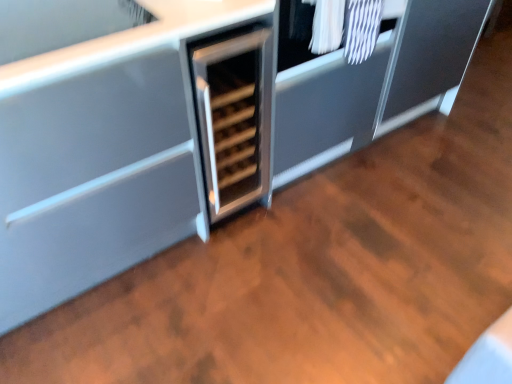
Question: Is satin silver wine cooler at center inside the boundaries of white textured laundry at upper right, or outside?

Choices:
 (A) inside
 (B) outside

Answer: (B)

Question: Is satin silver wine cooler at center in front of or behind white textured laundry at upper right in the image?

Choices:
 (A) front
 (B) behind

Answer: (B)

Question: In terms of height, does satin silver wine cooler at center look taller or shorter compared to white textured laundry at upper right?

Choices:
 (A) short
 (B) tall

Answer: (B)

Question: In the image, is white textured laundry at upper right on the left side or the right side of satin silver wine cooler at center?

Choices:
 (A) left
 (B) right

Answer: (B)

Question: Is white textured laundry at upper right bigger or smaller than satin silver wine cooler at center?

Choices:
 (A) big
 (B) small

Answer: (B)

Question: From a real-world perspective, is white textured laundry at upper right positioned above or below satin silver wine cooler at center?

Choices:
 (A) above
 (B) below

Answer: (A)

Question: Relative to satin silver wine cooler at center, is white textured laundry at upper right in front or behind?

Choices:
 (A) behind
 (B) front

Answer: (B)